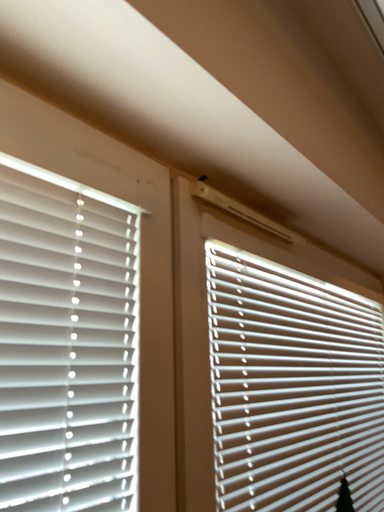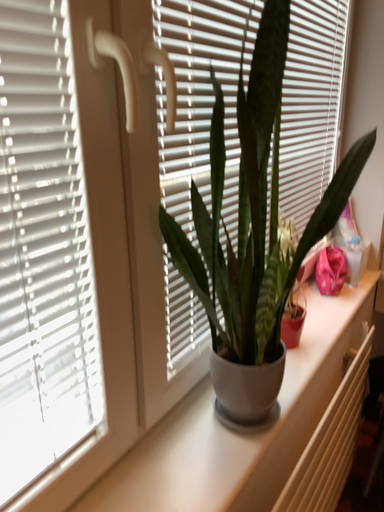
Question: How did the camera likely rotate when shooting the video?

Choices:
 (A) rotated downward
 (B) rotated upward

Answer: (A)